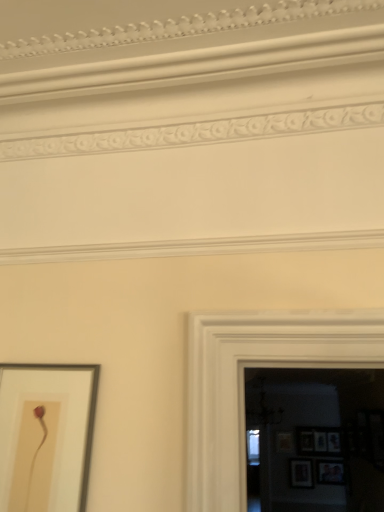
Question: From the image's perspective, would you say wooden picture frame at lower right, acting as the 3th picture frame starting from the front, is positioned over wooden picture frame at lower right, the fourth picture frame from the front?

Choices:
 (A) yes
 (B) no

Answer: (B)

Question: Considering the relative sizes of wooden picture frame at lower right, the 1th picture frame positioned from the bottom, and wooden picture frame at lower right, which ranks as the fourth picture frame in bottom-to-top order, in the image provided, is wooden picture frame at lower right, the 1th picture frame positioned from the bottom, bigger than wooden picture frame at lower right, which ranks as the fourth picture frame in bottom-to-top order,?

Choices:
 (A) yes
 (B) no

Answer: (B)

Question: From a real-world perspective, is wooden picture frame at lower right, the fifth picture frame viewed from the top, over wooden picture frame at lower right, which is the 4th picture frame in left-to-right order?

Choices:
 (A) yes
 (B) no

Answer: (B)

Question: Does wooden picture frame at lower right, the third picture frame when ordered from back to front, come behind wooden picture frame at lower right, placed as the second picture frame when sorted from right to left?

Choices:
 (A) yes
 (B) no

Answer: (B)

Question: Is wooden picture frame at lower right, the third picture frame when ordered from back to front, located outside wooden picture frame at lower right, which ranks as the fourth picture frame in bottom-to-top order?

Choices:
 (A) no
 (B) yes

Answer: (B)

Question: Is point (317, 480) positioned closer to the camera than point (296, 431)?

Choices:
 (A) farther
 (B) closer

Answer: (B)

Question: Is matte wooden picture frame at lower right, positioned as the fourth picture frame in top-to-bottom order, to the left or to the right of wooden picture frame at lower right, the fourth picture frame from the front, in the image?

Choices:
 (A) left
 (B) right

Answer: (B)

Question: Considering their positions, is matte wooden picture frame at lower right, the 2th picture frame positioned from the bottom, located in front of or behind wooden picture frame at lower right, which ranks as the fourth picture frame in bottom-to-top order?

Choices:
 (A) front
 (B) behind

Answer: (A)

Question: Considering the positions of matte wooden picture frame at lower right, which is the 4th picture frame from back to front, and wooden picture frame at lower right, which ranks as the fourth picture frame in bottom-to-top order, in the image, is matte wooden picture frame at lower right, which is the 4th picture frame from back to front, wider or thinner than wooden picture frame at lower right, which ranks as the fourth picture frame in bottom-to-top order,?

Choices:
 (A) wide
 (B) thin

Answer: (A)

Question: In terms of size, does matte white picture frame at lower left, marked as the first picture frame in a front-to-back arrangement, appear bigger or smaller than wooden picture frame at lower right, placed as the second picture frame when sorted from right to left?

Choices:
 (A) big
 (B) small

Answer: (B)

Question: In terms of width, does matte white picture frame at lower left, the first picture frame from the top, look wider or thinner when compared to wooden picture frame at lower right, which is the 4th picture frame in left-to-right order?

Choices:
 (A) thin
 (B) wide

Answer: (A)

Question: From a real-world perspective, is matte white picture frame at lower left, which is counted as the 1th picture frame, starting from the left, above or below wooden picture frame at lower right, placed as the second picture frame when sorted from right to left?

Choices:
 (A) above
 (B) below

Answer: (A)

Question: Relative to wooden picture frame at lower right, which ranks as the fourth picture frame in bottom-to-top order, is matte white picture frame at lower left, the first picture frame from the top, in front or behind?

Choices:
 (A) behind
 (B) front

Answer: (B)

Question: Is wooden picture frame at lower right, the 1th picture frame positioned from the bottom, taller or shorter than wooden picture frame at lower right, the second picture frame viewed from the top?

Choices:
 (A) short
 (B) tall

Answer: (A)

Question: In terms of width, does wooden picture frame at lower right, the third picture frame from the left, look wider or thinner when compared to wooden picture frame at lower right, the fourth picture frame from the front?

Choices:
 (A) thin
 (B) wide

Answer: (A)